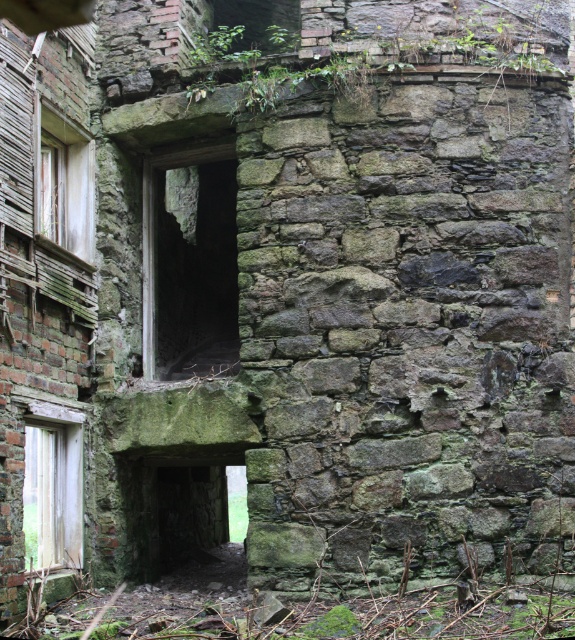
You are an explorer entering the old stone building. You see a wooden door at left and a wooden window at left. Which one takes up more space in the building?

The wooden window at left takes up more space than the wooden door at left because the wooden door at left occupies less space than the wooden window at left.

You are standing inside the old stone building and want to exit through one of the windows. Which window is closer to you, the green stone window at center or the wooden window at left?

The green stone window at center is closer to you because it is further to the viewer than the wooden window at left, meaning it is positioned nearer in the scene.

You are standing in front of the old stone building and want to determine the relative positions of two points marked on the structure. Which point is closer to you, point 1 at coordinates point (158, 356) or point 2 at coordinates point (67, 536)?

Point 1 at coordinates point (158, 356) is closer to you because it is further to the viewer than point 2 at coordinates point (67, 536).